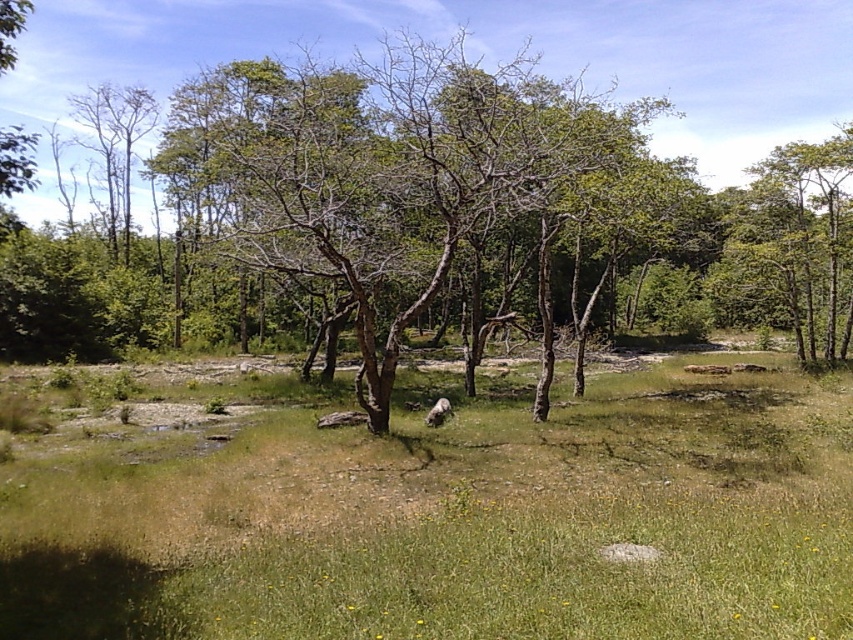
You are a gardener planning to water the green grass at center and the green leafy tree at upper right. Based on their positions in the image, which one would require you to walk further to reach from your current position at the edge of the image?

The green leafy tree at upper right is located above the green grass at center, so you would need to walk further to reach the green leafy tree at upper right from the edge of the image.

You are standing in the natural landscape described. You notice two points marked in the scene. Which point is nearer to you, point 1 at coordinates (706, 454) or point 2 at coordinates (804, 308)?

Point 1 at coordinates (706, 454) is closer to you than point 2 at coordinates (804, 308).

You are standing in the grassy area and want to walk towards the green leafy tree at upper right. Which direction should you turn to avoid the brown wood tree at center?

You should turn to the right to avoid the brown wood tree at center, as it is to the left of the green leafy tree at upper right.